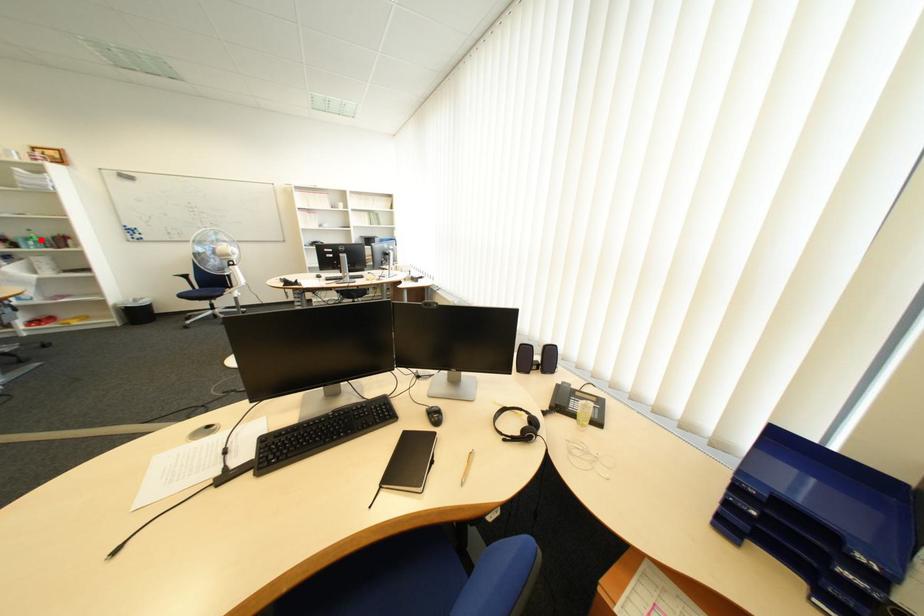
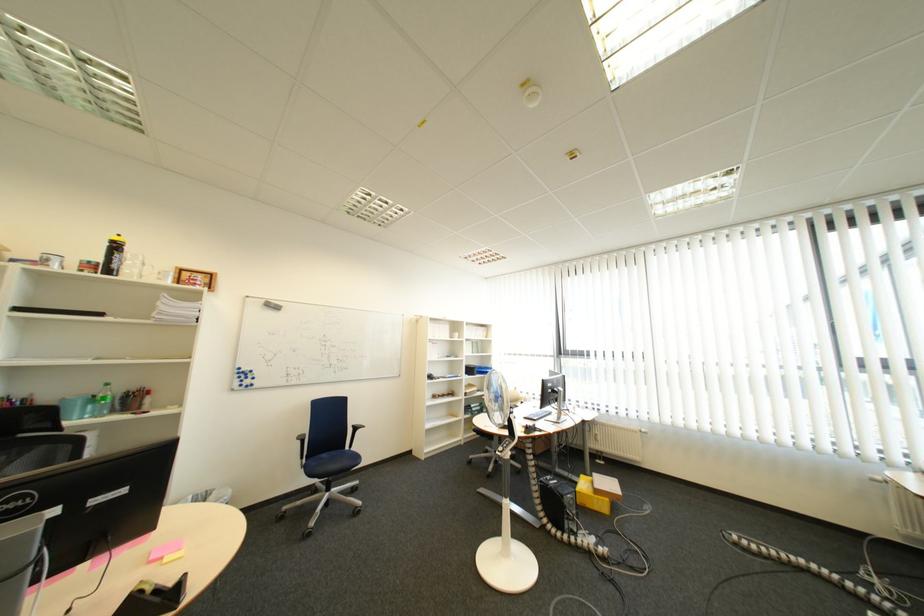
In the second image, find the point that corresponds to the highlighted location in the first image.

(105, 400)